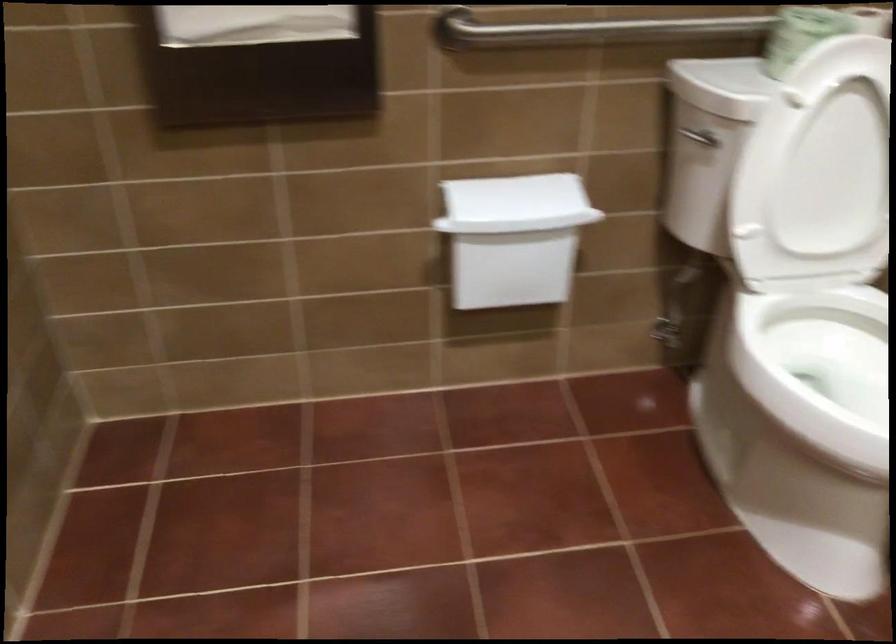
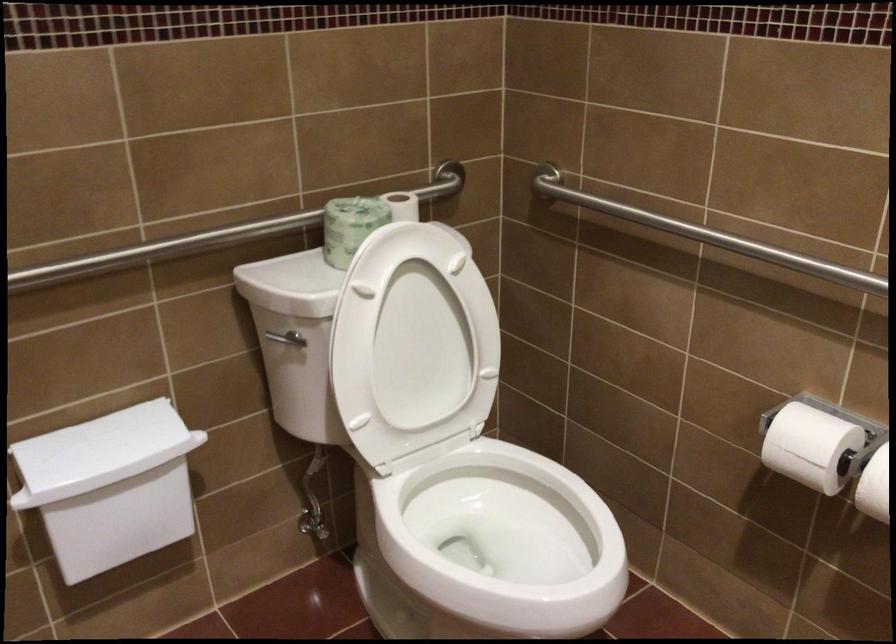
The point at (511,196) is marked in the first image. Where is the corresponding point in the second image?

(100, 450)